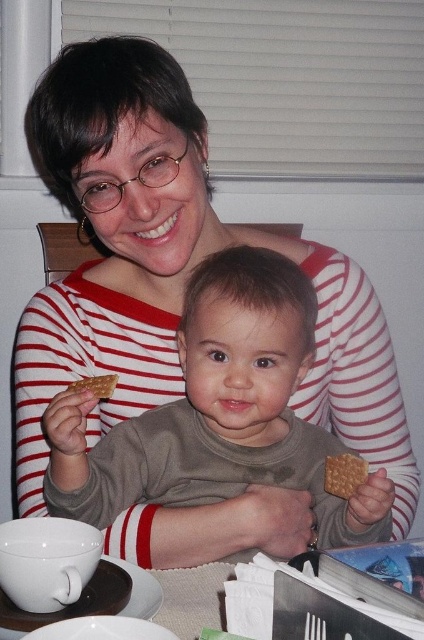
Describe the element at coordinates (219, 412) in the screenshot. I see `matte gray shirt at center` at that location.

Who is more forward, (106, 440) or (94, 387)?

Positioned in front is point (94, 387).

The height and width of the screenshot is (640, 424). Identify the location of matte gray shirt at center. tap(219, 412).

Locate an element on the screen. Image resolution: width=424 pixels, height=640 pixels. matte gray shirt at center is located at coordinates (219, 412).

What do you see at coordinates (219, 412) in the screenshot?
I see `matte gray shirt at center` at bounding box center [219, 412].

Identify the location of matte gray shirt at center. (219, 412).

Who is taller, matte brown cracker at lower right or crusty golden cracker at center?

matte brown cracker at lower right is taller.

Does matte brown cracker at lower right have a larger size compared to crusty golden cracker at center?

Correct, matte brown cracker at lower right is larger in size than crusty golden cracker at center.

Does point (359, 474) come farther from viewer compared to point (97, 394)?

That is True.

Identify the location of matte brown cracker at lower right. This screenshot has width=424, height=640. (343, 474).